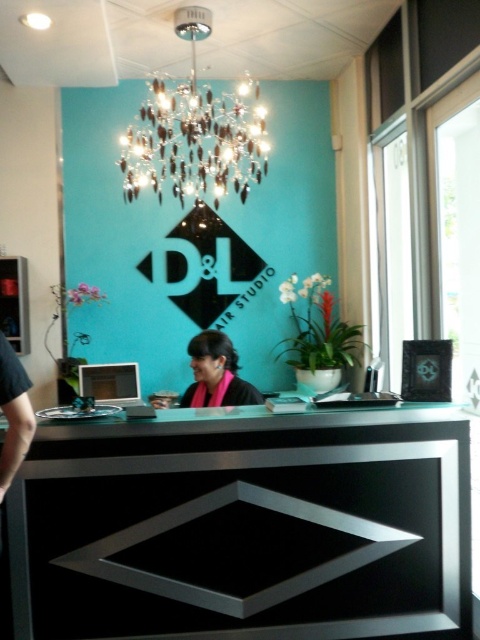
You are a customer entering D L Hair Studio and want to sit near the black glossy table at center and the crystal glass chandelier at upper center. Which object should you sit closer to if you want to be in a more open area?

The black glossy table at center occupies less space than the crystal glass chandelier at upper center, so you should sit closer to the black glossy table at center to be in a more open area.

Looking at this image, you are a customer entering D L Hair Studio and want to ask for a haircut appointment. You see the black glossy table at center and the crystal glass chandelier at upper center. Which object is closer to the ceiling?

The crystal glass chandelier at upper center is closer to the ceiling since it is located above the black glossy table at center.

You are a customer entering D L Hair Studio and looking around. You notice the crystal glass chandelier at upper center and the pink fabric scarf at center. Which object is closer to you from your vantage point?

The crystal glass chandelier at upper center is closer to you because the pink fabric scarf at center is behind it.